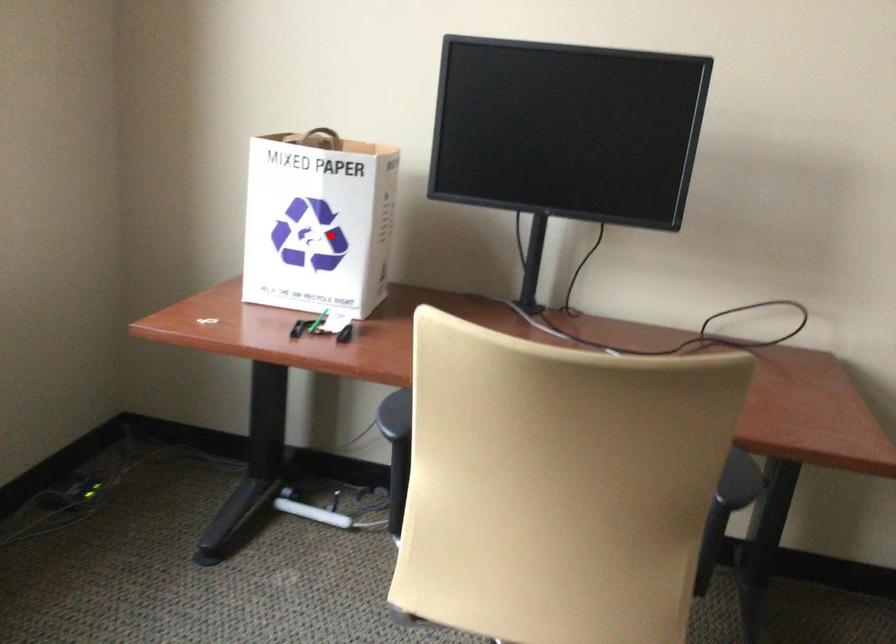
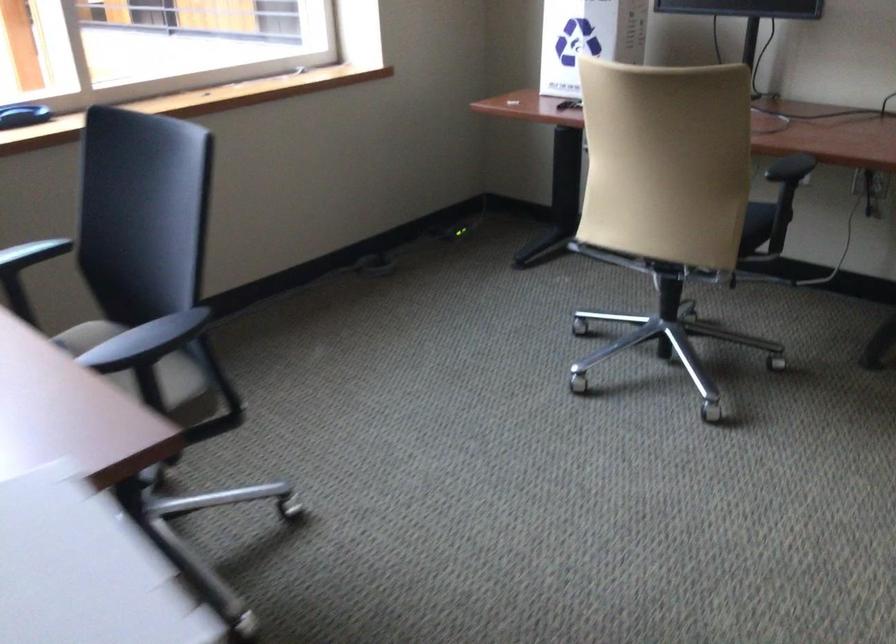
In the second image, find the point that corresponds to the highlighted location in the first image.

(588, 39)